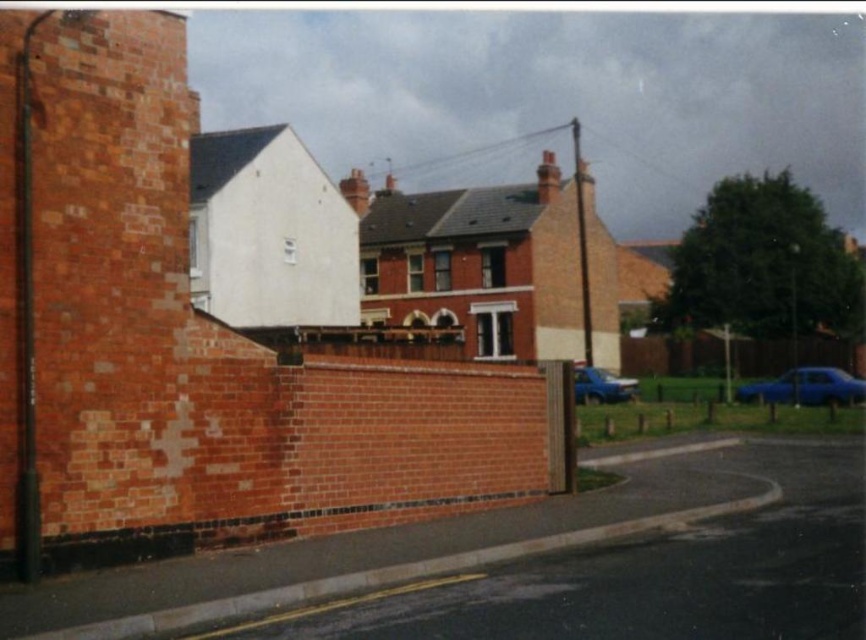
Who is higher up, blue matte car at right or blue metallic car at lower right?

blue matte car at right is higher up.

Identify the location of blue matte car at right. (806, 387).